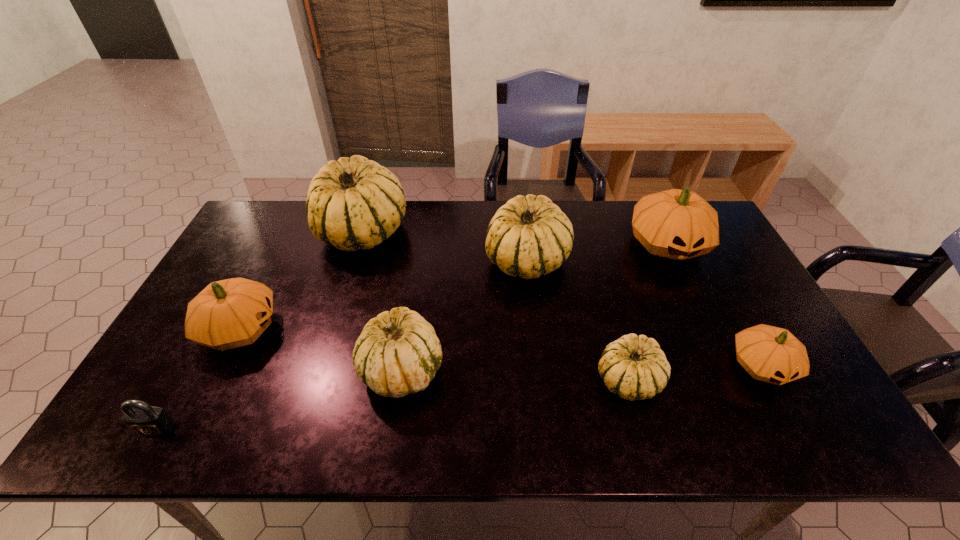
Find the location of a particular element. free space between the second smallest white gourd and the second biggest orange gourd is located at coordinates (322, 349).

You are a GUI agent. You are given a task and a screenshot of the screen. Output one action in this format:
    pyautogui.click(x=<x>, y=<y>)
    Task: Click on the free space between the smallest orange gourd and the second smallest orange gourd
    
    Given the screenshot: What is the action you would take?
    pyautogui.click(x=501, y=347)

Find the location of a particular element. empty space between the farthest orange gourd and the leftmost orange gourd is located at coordinates (454, 287).

This screenshot has height=540, width=960. I want to click on free spot between the biggest orange gourd and the leftmost orange gourd, so click(x=454, y=287).

Select which object appears as the third closest to the fourth gourd from left to right. Please provide its 2D coordinates. Your answer should be formatted as a tuple, i.e. [(x, y)], where the tuple contains the x and y coordinates of a point satisfying the conditions above.

[(634, 367)]

Identify which object is located as the fifth nearest to the leftmost orange gourd. Please provide its 2D coordinates. Your answer should be formatted as a tuple, i.e. [(x, y)], where the tuple contains the x and y coordinates of a point satisfying the conditions above.

[(634, 367)]

This screenshot has height=540, width=960. In order to click on gourd identified as the fourth closest to the farthest orange gourd in this screenshot , I will do `click(398, 353)`.

At what (x,y) coordinates should I click in order to perform the action: click on the fifth closest gourd to the smallest white gourd. Please return your answer as a coordinate pair (x, y). Looking at the image, I should click on (354, 203).

At what (x,y) coordinates should I click in order to perform the action: click on white gourd that is the second closest to the rightmost white gourd. Please return your answer as a coordinate pair (x, y). Looking at the image, I should click on (398, 353).

Point out which white gourd is positioned as the nearest to the fourth gourd from left to right. Please provide its 2D coordinates. Your answer should be formatted as a tuple, i.e. [(x, y)], where the tuple contains the x and y coordinates of a point satisfying the conditions above.

[(398, 353)]